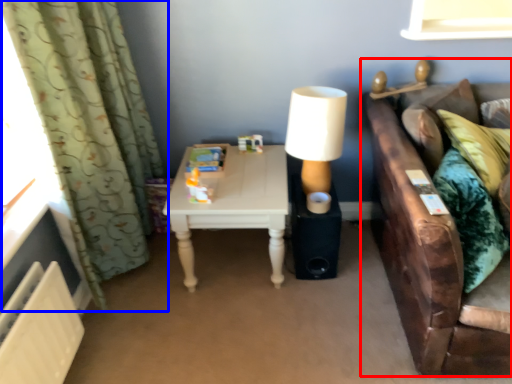
Question: Among these objects, which one is nearest to the camera, studio couch (highlighted by a red box) or curtain (highlighted by a blue box)?

Choices:
 (A) studio couch
 (B) curtain

Answer: (A)